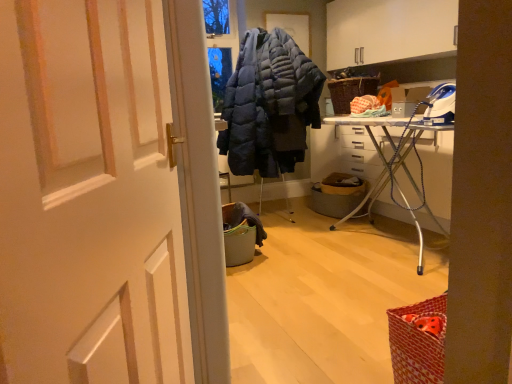
Measure the distance between point [334,111] and camera.

Point [334,111] is 4.39 meters from camera.

What is the approximate width of dark blue quilted jacket at center?

The width of dark blue quilted jacket at center is 31.04 inches.

Where is `white matte door at center`? white matte door at center is located at coordinates (89, 197).

Identify the location of woven brown picnic basket at upper right. (350, 91).

Which object is closer to the camera taking this photo, white metal ironing board at center right or white matte door at center?

white matte door at center is more forward.

Where is `furniture lying above the white matte door at center (from the image's perspective)`? This screenshot has height=384, width=512. furniture lying above the white matte door at center (from the image's perspective) is located at coordinates (392, 168).

Considering the relative sizes of white metal ironing board at center right and white matte door at center in the image provided, is white metal ironing board at center right thinner than white matte door at center?

In fact, white metal ironing board at center right might be wider than white matte door at center.

At what (x,y) coordinates should I click in order to perform the action: click on jacket behind the white metal ironing board at center right. Please return your answer as a coordinate pair (x, y). This screenshot has width=512, height=384. Looking at the image, I should click on (269, 105).

Does white metal ironing board at center right have a larger size compared to dark blue quilted jacket at center?

Yes.

Is white metal ironing board at center right further to camera compared to dark blue quilted jacket at center?

No, white metal ironing board at center right is closer to the camera.

Is white metal ironing board at center right far away from dark blue quilted jacket at center?

No.

Where is `door located underneath the woven brown picnic basket at upper right (from a real-world perspective)`? The width and height of the screenshot is (512, 384). door located underneath the woven brown picnic basket at upper right (from a real-world perspective) is located at coordinates (89, 197).

How many degrees apart are the facing directions of white matte door at center and woven brown picnic basket at upper right?

There is a 149-degree angle between the facing directions of white matte door at center and woven brown picnic basket at upper right.

Are white matte door at center and woven brown picnic basket at upper right located far from each other?

Yes, white matte door at center and woven brown picnic basket at upper right are located far from each other.

Looking at this image, does white matte door at center have a greater height compared to woven brown picnic basket at upper right?

Yes.

Considering the relative positions of woven brown picnic basket at upper right and white matte door at center in the image provided, is woven brown picnic basket at upper right to the right of white matte door at center from the viewer's perspective?

Correct, you'll find woven brown picnic basket at upper right to the right of white matte door at center.

Which object is further away from the camera taking this photo, woven brown picnic basket at upper right or white matte door at center?

woven brown picnic basket at upper right.

Does woven brown picnic basket at upper right have a greater height compared to white matte door at center?

In fact, woven brown picnic basket at upper right may be shorter than white matte door at center.

Consider the image. Is woven brown picnic basket at upper right aimed at white matte door at center?

No, woven brown picnic basket at upper right is not aimed at white matte door at center.

From the picture: Could you tell me if white metal ironing board at center right is facing metallic gray laundry basket at center?

Yes, white metal ironing board at center right is turned towards metallic gray laundry basket at center.

The height and width of the screenshot is (384, 512). Find the location of `furniture above the metallic gray laundry basket at center (from the image's perspective)`. furniture above the metallic gray laundry basket at center (from the image's perspective) is located at coordinates (392, 168).

Based on the photo, from the image's perspective, which one is positioned lower, white metal ironing board at center right or metallic gray laundry basket at center?

metallic gray laundry basket at center is shown below in the image.

Is metallic gray laundry basket at center with woven brown picnic basket at upper right?

No, metallic gray laundry basket at center is not beside woven brown picnic basket at upper right.

Is metallic gray laundry basket at center at the right side of woven brown picnic basket at upper right?

In fact, metallic gray laundry basket at center is to the left of woven brown picnic basket at upper right.

Find the location of a particular element. The height and width of the screenshot is (384, 512). picnic basket located above the metallic gray laundry basket at center (from the image's perspective) is located at coordinates (350, 91).

In the image, is metallic gray laundry basket at center positioned in front of or behind woven brown picnic basket at upper right?

metallic gray laundry basket at center is positioned closer to the viewer than woven brown picnic basket at upper right.

Is point (348, 204) in front of point (36, 181)?

No, (348, 204) is behind (36, 181).

Which of these two, metallic gray laundry basket at center or white matte door at center, is bigger?

Bigger between the two is white matte door at center.

In the image, is metallic gray laundry basket at center positioned in front of or behind white matte door at center?

Clearly, metallic gray laundry basket at center is behind white matte door at center.

This screenshot has height=384, width=512. What are the coordinates of `furniture on the right of the white matte door at center` in the screenshot? It's located at (392, 168).

Where is `furniture that is in front of the dark blue quilted jacket at center`? furniture that is in front of the dark blue quilted jacket at center is located at coordinates (392, 168).

From the image, which object appears to be nearer to woven brown picnic basket at upper right, metallic gray laundry basket at center or white matte door at center?

metallic gray laundry basket at center is closer to woven brown picnic basket at upper right.

Considering their positions, is metallic gray laundry basket at center positioned further to woven brown picnic basket at upper right than white metal ironing board at center right?

Based on the image, white metal ironing board at center right appears to be further to woven brown picnic basket at upper right.

Considering their positions, is white matte door at center positioned further to white metal ironing board at center right than metallic gray laundry basket at center?

white matte door at center is further to white metal ironing board at center right.

From the image, which object appears to be farther from white metal ironing board at center right, metallic gray laundry basket at center or woven brown picnic basket at upper right?

woven brown picnic basket at upper right is positioned further to the anchor white metal ironing board at center right.

When comparing their distances from metallic gray laundry basket at center, does white matte door at center or white metal ironing board at center right seem further?

white matte door at center is further to metallic gray laundry basket at center.

Looking at the image, which one is located further to metallic gray laundry basket at center, dark blue quilted jacket at center or woven brown picnic basket at upper right?

woven brown picnic basket at upper right.

Looking at the image, which one is located closer to dark blue quilted jacket at center, white matte door at center or woven brown picnic basket at upper right?

woven brown picnic basket at upper right lies closer to dark blue quilted jacket at center than the other object.

Based on their spatial positions, is woven brown picnic basket at upper right or metallic gray laundry basket at center further from white matte door at center?

woven brown picnic basket at upper right is further to white matte door at center.

Identify the location of laundry basket between white metal ironing board at center right and woven brown picnic basket at upper right from front to back. This screenshot has width=512, height=384. (337, 195).

Where is `laundry basket between dark blue quilted jacket at center and white metal ironing board at center right`? laundry basket between dark blue quilted jacket at center and white metal ironing board at center right is located at coordinates (337, 195).

I want to click on jacket that lies between woven brown picnic basket at upper right and metallic gray laundry basket at center from top to bottom, so click(x=269, y=105).

Image resolution: width=512 pixels, height=384 pixels. In order to click on furniture between white matte door at center and dark blue quilted jacket at center from front to back in this screenshot , I will do `click(392, 168)`.